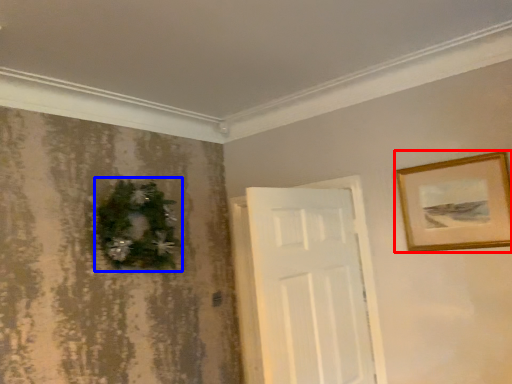
Question: Which of the following is the closest to the observer, picture frame (highlighted by a red box) or christmas decoration (highlighted by a blue box)?

Choices:
 (A) picture frame
 (B) christmas decoration

Answer: (A)